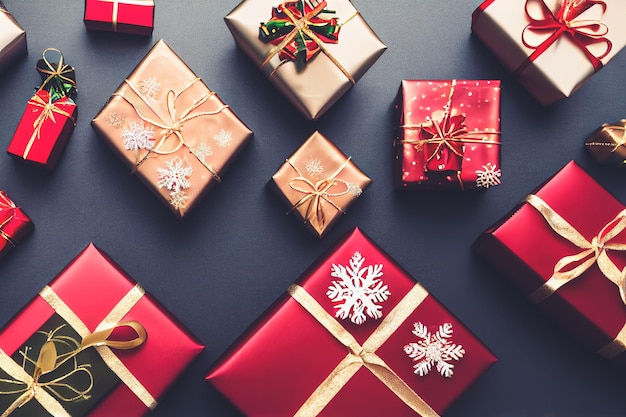
The image size is (626, 417). Identify the location of christmas ribbon. (33, 388), (303, 18), (563, 22), (598, 251), (438, 142).